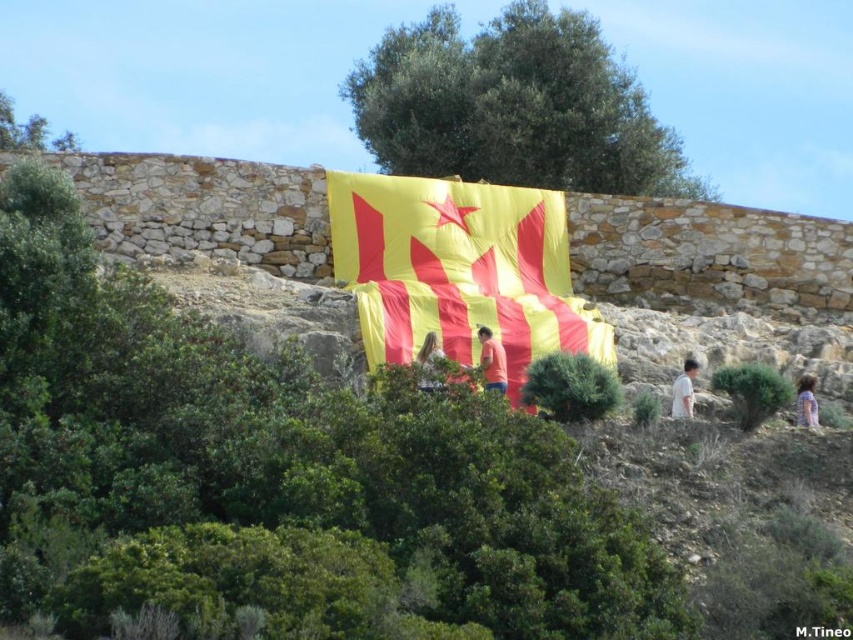
You are a photographer trying to capture the flag in the scene. You notice two instances of light brown hair at center and light brown hair at right in the foreground. Which one is closer to the camera?

The light brown hair at center is closer to the camera because the light brown hair at right is behind it.